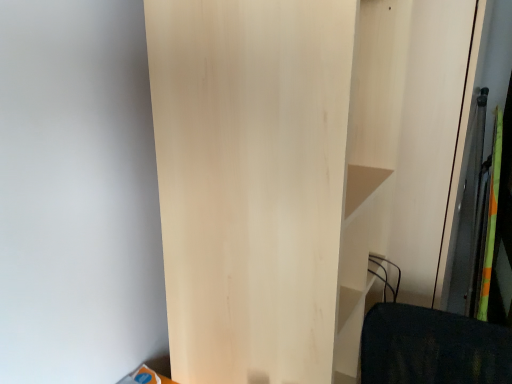
Question: Should I look upward or downward to see light wood dresser at center?

Choices:
 (A) down
 (B) up

Answer: (A)